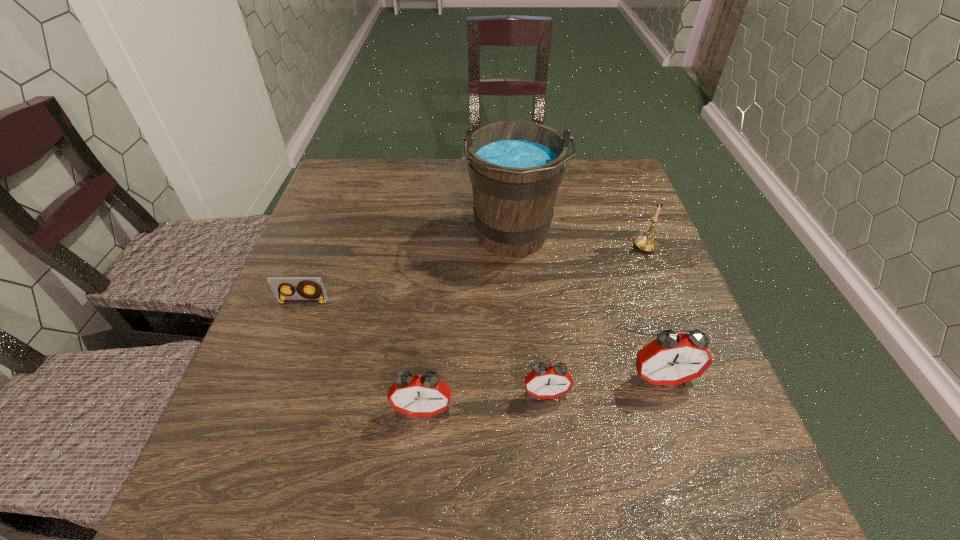
In the image, there is a desktop. In order to click on vacant space at the right edge in this screenshot , I will do `click(615, 299)`.

What are the coordinates of `vacant region at the far left corner of the desktop` in the screenshot? It's located at (355, 159).

The image size is (960, 540). What are the coordinates of `vacant area at the near left corner` in the screenshot? It's located at (241, 435).

In the image, there is a desktop. At what (x,y) coordinates should I click in order to perform the action: click on vacant space at the far right corner. Please return your answer as a coordinate pair (x, y). Looking at the image, I should click on (614, 178).

In the image, there is a desktop. Identify the location of vacant area at the near right corner. Image resolution: width=960 pixels, height=540 pixels. (735, 427).

Locate an element on the screen. This screenshot has height=540, width=960. free space between the rightmost alarm clock and the videotape is located at coordinates (482, 340).

Find the location of a particular element. Image resolution: width=960 pixels, height=540 pixels. vacant area between the fifth object from right to left and the shortest alarm clock is located at coordinates (484, 402).

Where is `free space between the tallest object and the shortest alarm clock`? The width and height of the screenshot is (960, 540). free space between the tallest object and the shortest alarm clock is located at coordinates (529, 316).

The height and width of the screenshot is (540, 960). Identify the location of free space between the tallest object and the tallest alarm clock. (587, 308).

Identify the location of free space between the shortest object and the second object from left to right. click(x=363, y=356).